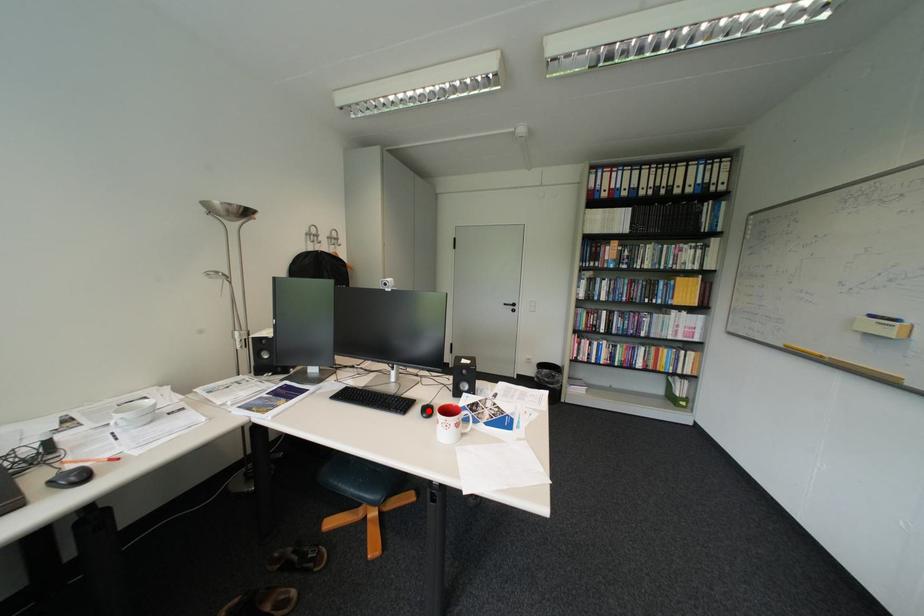
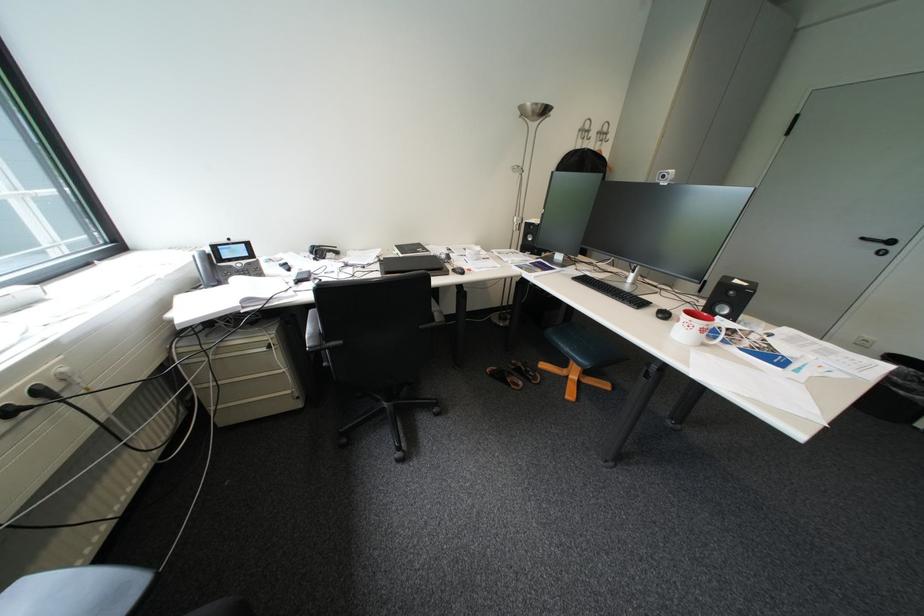
Locate, in the second image, the point that corresponds to the highlighted location in the first image.

(663, 310)